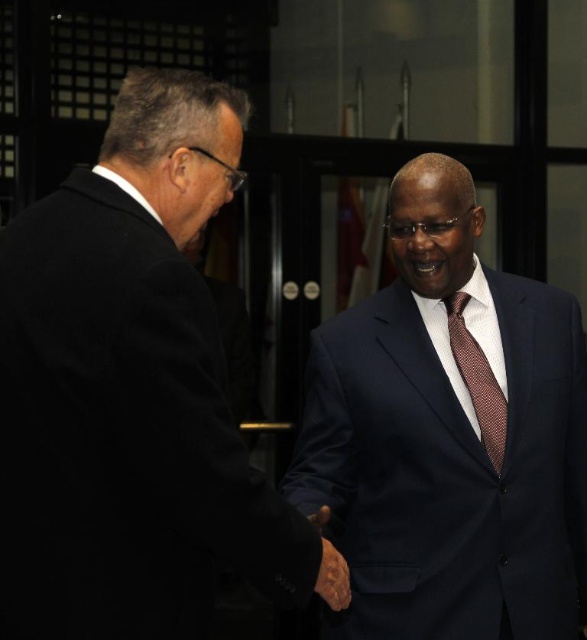
Question: Is navy blue suit at center in front of brown dotted tie at center?

Choices:
 (A) yes
 (B) no

Answer: (A)

Question: Which of the following is the closest to the observer?

Choices:
 (A) navy blue suit at center
 (B) brown dotted tie at center
 (C) black suit at left

Answer: (C)

Question: Which object is closer to the camera taking this photo?

Choices:
 (A) navy blue suit at center
 (B) brown dotted tie at center
 (C) black suit at left

Answer: (C)

Question: Does black suit at left come in front of brown dotted tie at center?

Choices:
 (A) no
 (B) yes

Answer: (B)

Question: Does black suit at left appear over navy blue suit at center?

Choices:
 (A) yes
 (B) no

Answer: (A)

Question: Which point appears closest to the camera in this image?

Choices:
 (A) (474, 310)
 (B) (495, 413)
 (C) (62, 216)

Answer: (C)